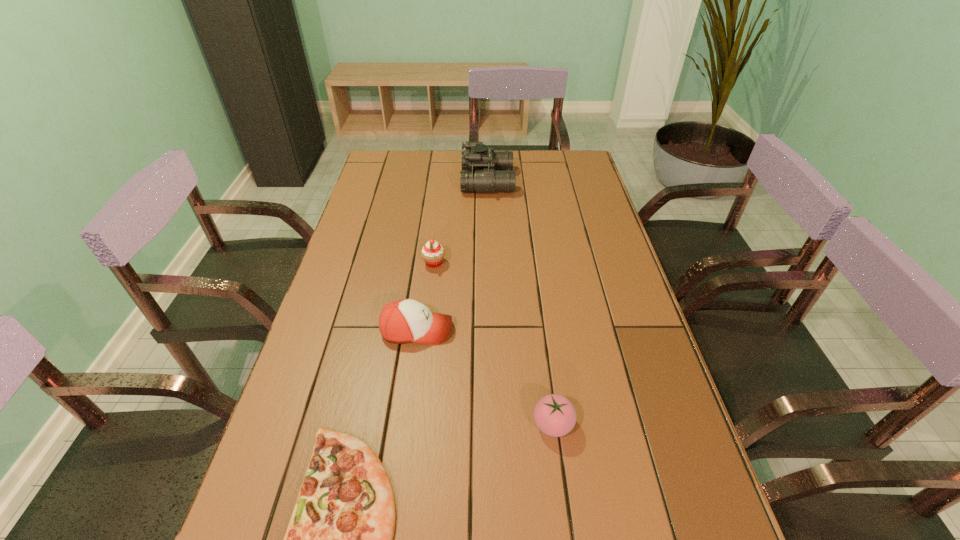
Locate an element on the screen. This screenshot has height=540, width=960. the farthest object is located at coordinates (484, 170).

Where is `the tallest object`? This screenshot has height=540, width=960. the tallest object is located at coordinates (484, 170).

Where is `the second farthest object`? Image resolution: width=960 pixels, height=540 pixels. the second farthest object is located at coordinates (432, 253).

This screenshot has width=960, height=540. I want to click on the third nearest object, so click(405, 320).

Where is `the second shortest object`? This screenshot has height=540, width=960. the second shortest object is located at coordinates (555, 415).

Where is `vacant space located through the lenses of the binoculars`? This screenshot has height=540, width=960. vacant space located through the lenses of the binoculars is located at coordinates (376, 181).

You are a GUI agent. You are given a task and a screenshot of the screen. Output one action in this format:
    pyautogui.click(x=<x>, y=<y>)
    Task: Click on the vacant space situated through the lenses of the binoculars
    The height and width of the screenshot is (540, 960).
    Given the screenshot: What is the action you would take?
    pyautogui.click(x=406, y=181)

Identify the location of blank area located through the lenses of the binoculars. This screenshot has width=960, height=540. (438, 181).

Identify the location of free point located 0.290m on the back of the cupcake. Image resolution: width=960 pixels, height=540 pixels. (441, 202).

Locate an element on the screen. Image resolution: width=960 pixels, height=540 pixels. vacant space located 0.180m on the front-facing side of the third nearest object is located at coordinates (523, 329).